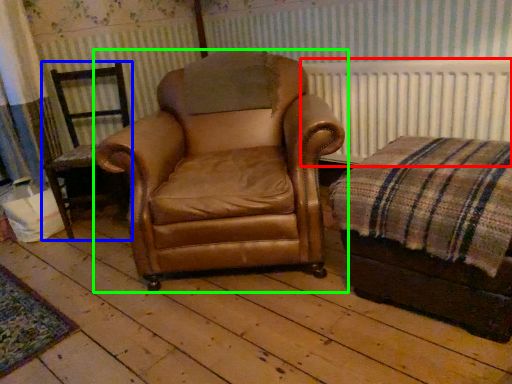
Question: Based on their relative distances, which object is farther from radiator (highlighted by a red box)? Choose from chair (highlighted by a blue box) and chair (highlighted by a green box).

Choices:
 (A) chair
 (B) chair

Answer: (A)